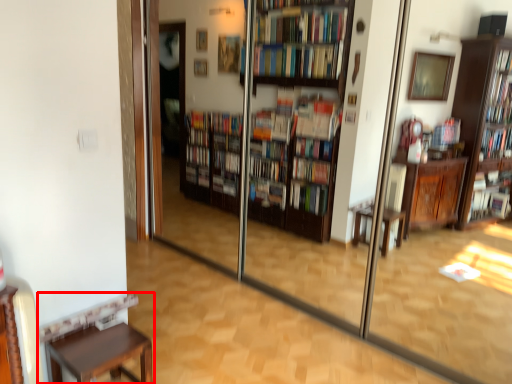
Question: Considering the relative positions of furniture (annotated by the red box) and screen door in the image provided, where is furniture (annotated by the red box) located with respect to the staircase?

Choices:
 (A) left
 (B) right

Answer: (A)